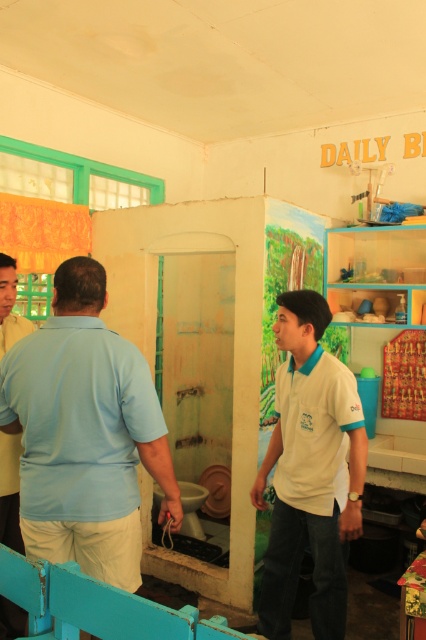
Question: Does light blue cotton shirt at center have a lesser width compared to white cotton shirt at center?

Choices:
 (A) no
 (B) yes

Answer: (A)

Question: Which is farther from the light blue cotton shirt at center?

Choices:
 (A) white cotton shirt at center
 (B) light blue shirt at left

Answer: (A)

Question: Which of these objects is positioned closest to the white cotton shirt at center?

Choices:
 (A) light blue cotton shirt at center
 (B) light blue shirt at left

Answer: (A)

Question: Is the position of light blue cotton shirt at center less distant than that of white cotton shirt at center?

Choices:
 (A) no
 (B) yes

Answer: (B)

Question: Which is nearer to the light blue cotton shirt at center?

Choices:
 (A) white cotton shirt at center
 (B) light blue shirt at left

Answer: (B)

Question: Does light blue cotton shirt at center appear on the left side of light blue shirt at left?

Choices:
 (A) yes
 (B) no

Answer: (B)